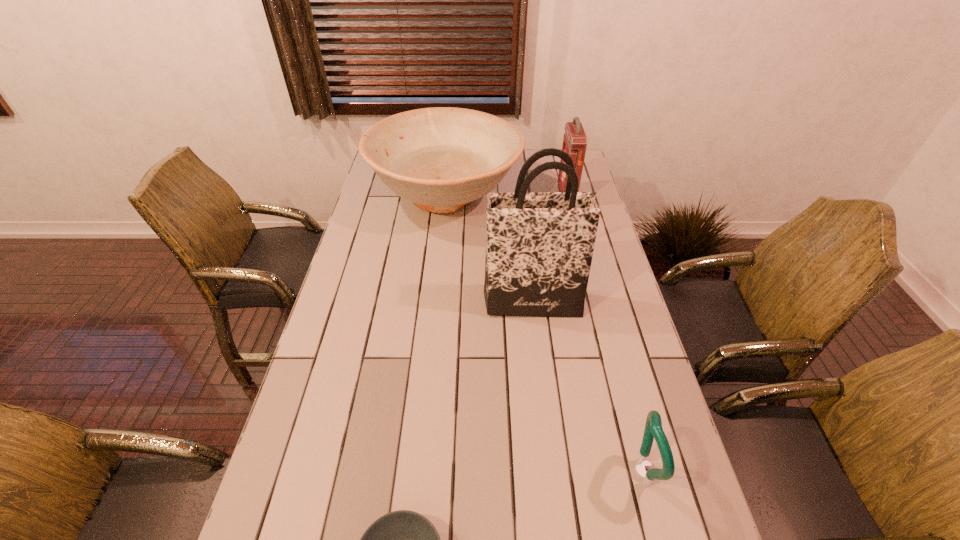
At what (x,y) coordinates should I click in order to perform the action: click on free space at the left edge of the desktop. Please return your answer as a coordinate pair (x, y). The image size is (960, 540). Looking at the image, I should click on (331, 359).

In the image, there is a desktop. At what (x,y) coordinates should I click in order to perform the action: click on vacant space at the right edge. Please return your answer as a coordinate pair (x, y). The image size is (960, 540). Looking at the image, I should click on (593, 293).

This screenshot has width=960, height=540. In order to click on vacant space that's between the second nearest object and the dish in this screenshot , I will do `click(542, 334)`.

Identify the location of vacant region between the dish and the fourth farthest object. (x=542, y=334).

Select which object is the closest to the third nearest object. Please provide its 2D coordinates. Your answer should be formatted as a tuple, i.e. [(x, y)], where the tuple contains the x and y coordinates of a point satisfying the conditions above.

[(441, 158)]

Select which object appears as the second closest to the fourth tallest object. Please provide its 2D coordinates. Your answer should be formatted as a tuple, i.e. [(x, y)], where the tuple contains the x and y coordinates of a point satisfying the conditions above.

[(403, 539)]

Locate an element on the screen. Image resolution: width=960 pixels, height=540 pixels. vacant space that satisfies the following two spatial constraints: 1. on the front-facing side of the fourth shortest object; 2. on the front of the tallest object with the design is located at coordinates (593, 303).

Identify the location of vacant space that satisfies the following two spatial constraints: 1. on the front-facing side of the first-aid kit; 2. on the front of the tallest object with the design. This screenshot has height=540, width=960. (593, 303).

Identify the location of free spot that satisfies the following two spatial constraints: 1. on the front-facing side of the second tallest object; 2. on the front of the shopping bag with the design. The image size is (960, 540). click(593, 303).